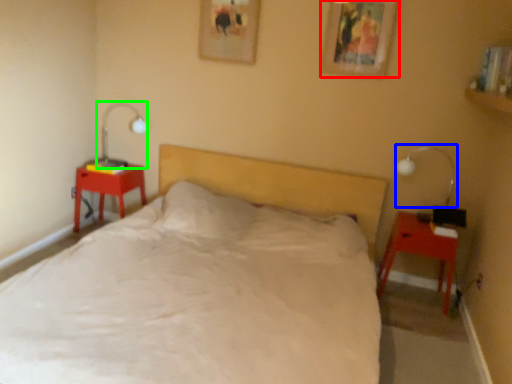
Question: Considering the real-world distances, which object is closest to picture frame (highlighted by a red box)? bedside lamp (highlighted by a blue box) or table lamp (highlighted by a green box).

Choices:
 (A) bedside lamp
 (B) table lamp

Answer: (A)